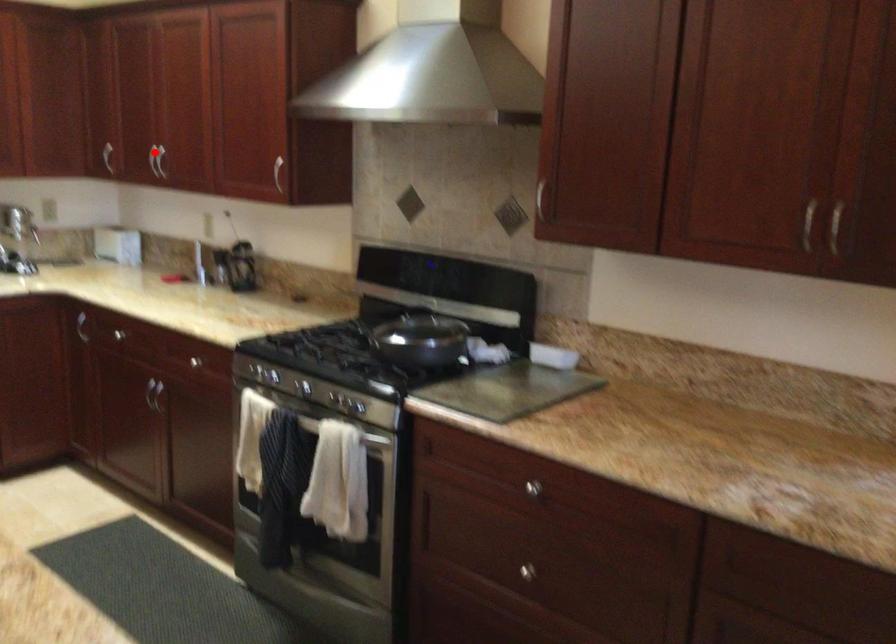
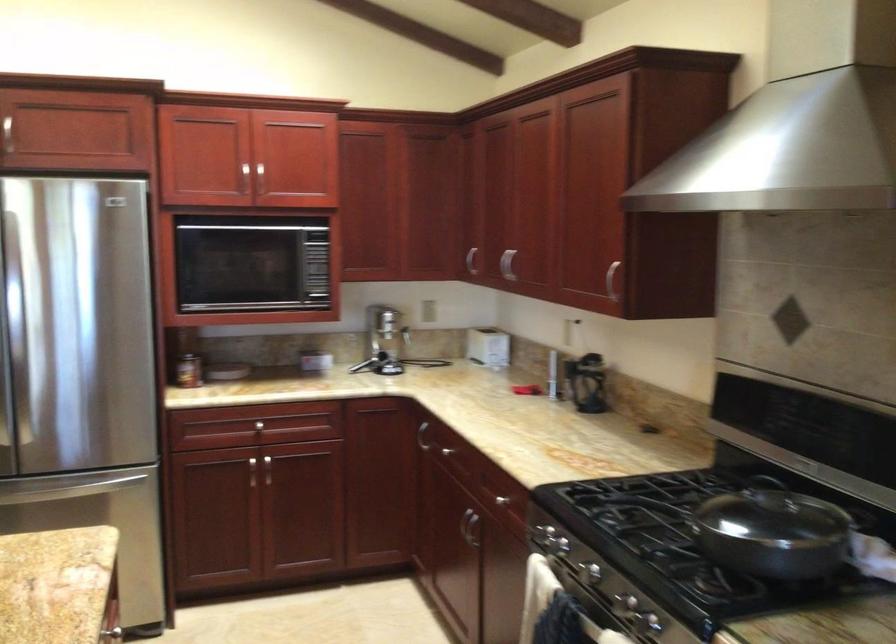
Question: I am providing you with two images of the same scene from different viewpoints. A red point is marked on the first image. At the location where the point appears in image 1, is it still visible in image 2?

Choices:
 (A) Yes
 (B) No

Answer: (A)